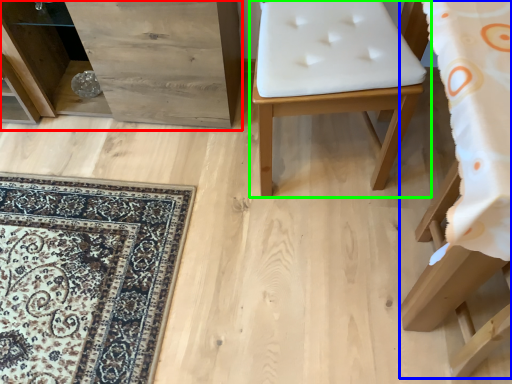
Question: Based on their relative distances, which object is farther from dresser (highlighted by a red box)? Choose from furniture (highlighted by a blue box) and furniture (highlighted by a green box).

Choices:
 (A) furniture
 (B) furniture

Answer: (A)